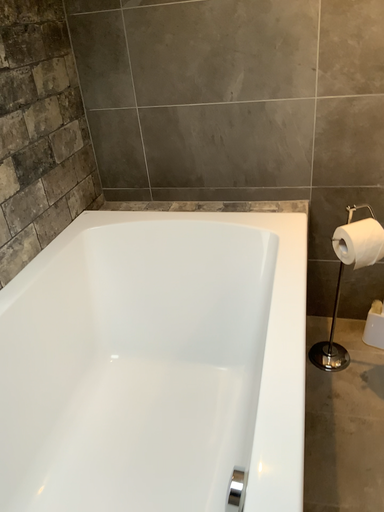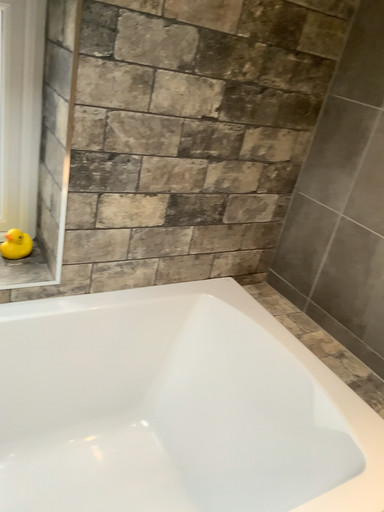
Question: How did the camera likely rotate when shooting the video?

Choices:
 (A) rotated left
 (B) rotated right

Answer: (A)